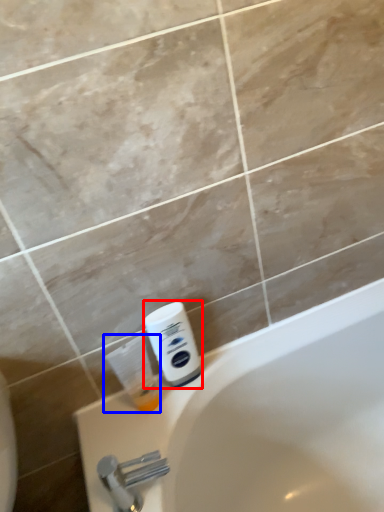
Question: Which point is closer to the camera, shaving cream (highlighted by a red box) or cleaning product (highlighted by a blue box)?

Choices:
 (A) shaving cream
 (B) cleaning product

Answer: (B)